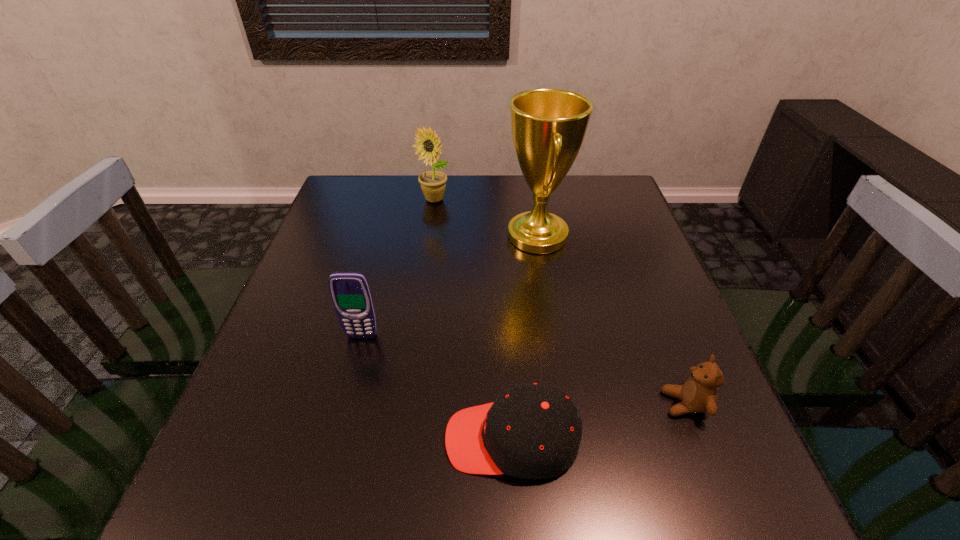
You are a GUI agent. You are given a task and a screenshot of the screen. Output one action in this format:
    pyautogui.click(x=<x>, y=<y>)
    Task: Click on the free space between the sunflower and the cap
    
    Given the screenshot: What is the action you would take?
    pyautogui.click(x=472, y=319)

The height and width of the screenshot is (540, 960). Identify the location of vacant area between the sunflower and the cap. (472, 319).

Find the location of a particular element. Image resolution: width=960 pixels, height=540 pixels. unoccupied area between the cellular telephone and the tallest object is located at coordinates (449, 286).

Find the location of a particular element. free point between the cap and the award is located at coordinates (524, 338).

You are a GUI agent. You are given a task and a screenshot of the screen. Output one action in this format:
    pyautogui.click(x=<x>, y=<y>)
    Task: Click on the free spot between the sunflower and the tallest object
    The image size is (960, 540).
    Given the screenshot: What is the action you would take?
    tap(486, 218)

Locate an element on the screen. vacant area between the tallest object and the second object from left to right is located at coordinates (486, 218).

The width and height of the screenshot is (960, 540). What are the coordinates of `vacant space in between the cap and the fourth shortest object` in the screenshot? It's located at (472, 319).

Find the location of `empty space that is in between the leftmost object and the cap`. empty space that is in between the leftmost object and the cap is located at coordinates (437, 388).

Image resolution: width=960 pixels, height=540 pixels. What are the coordinates of `free spot between the award and the cap` in the screenshot? It's located at (524, 338).

Identify the location of free spot between the teddy bear and the third nearest object. (523, 370).